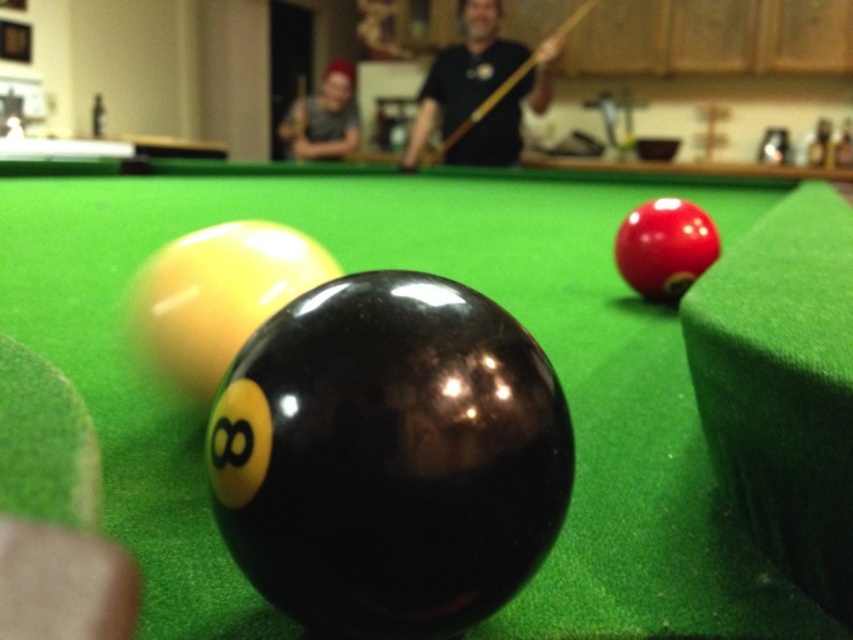
Is matte gray shirt at upper center to the right of wooden at center from the viewer's perspective?

In fact, matte gray shirt at upper center is to the left of wooden at center.

Between matte gray shirt at upper center and wooden at center, which one appears on the right side from the viewer's perspective?

From the viewer's perspective, wooden at center appears more on the right side.

Measure the distance between point [352,84] and camera.

Point [352,84] is 24.51 feet away from camera.

What are the coordinates of `matte gray shirt at upper center` in the screenshot? It's located at (323, 116).